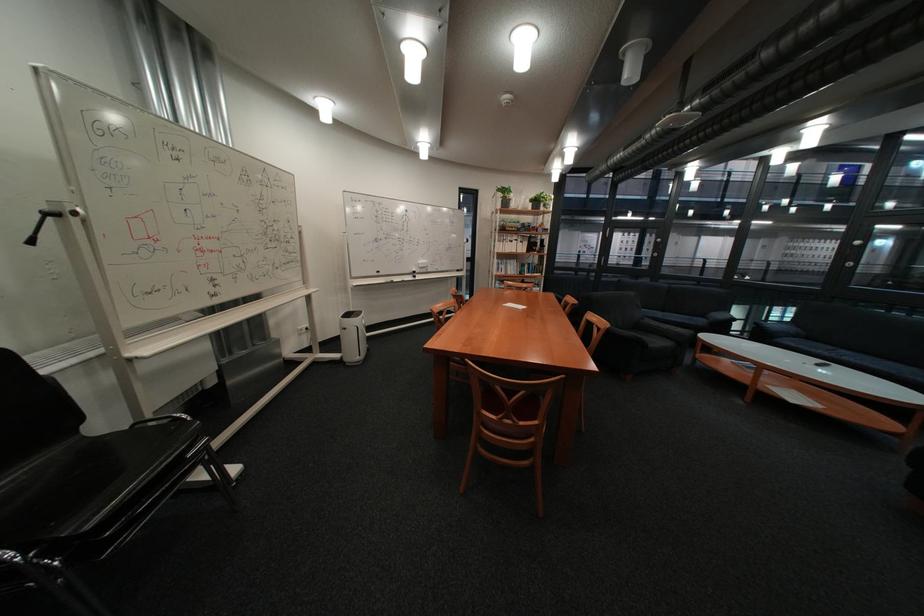
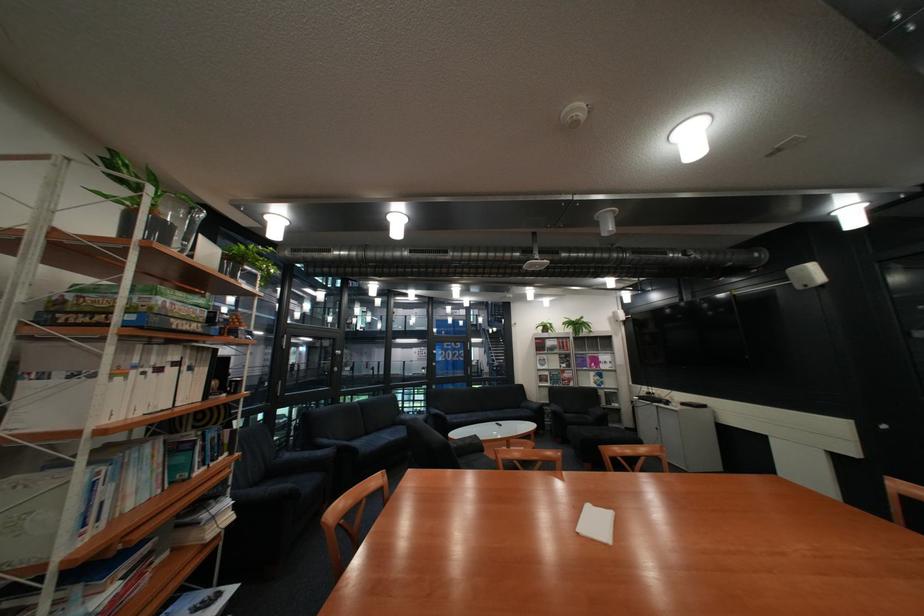
Where in the second image is the point corresponding to pixel 527 262 from the first image?

(163, 448)